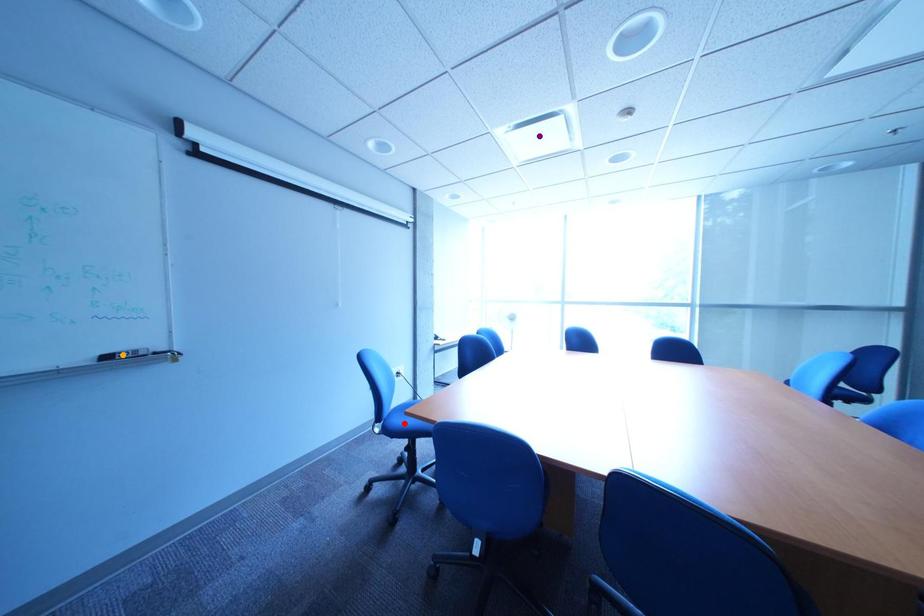
Order these from nearest to farthest:
orange point | red point | purple point

orange point → purple point → red point